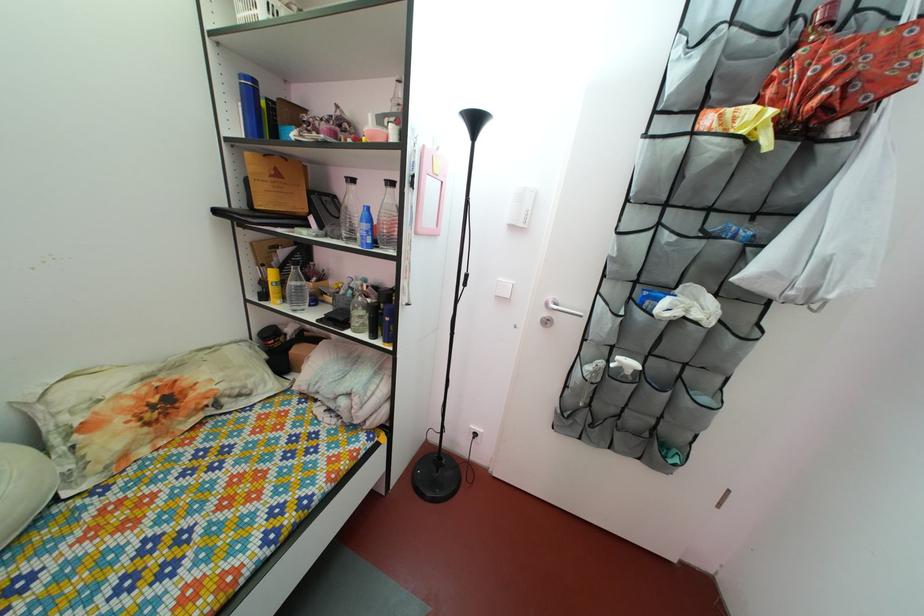
The image size is (924, 616). Describe the element at coordinates (520, 206) in the screenshot. I see `the white light switch` at that location.